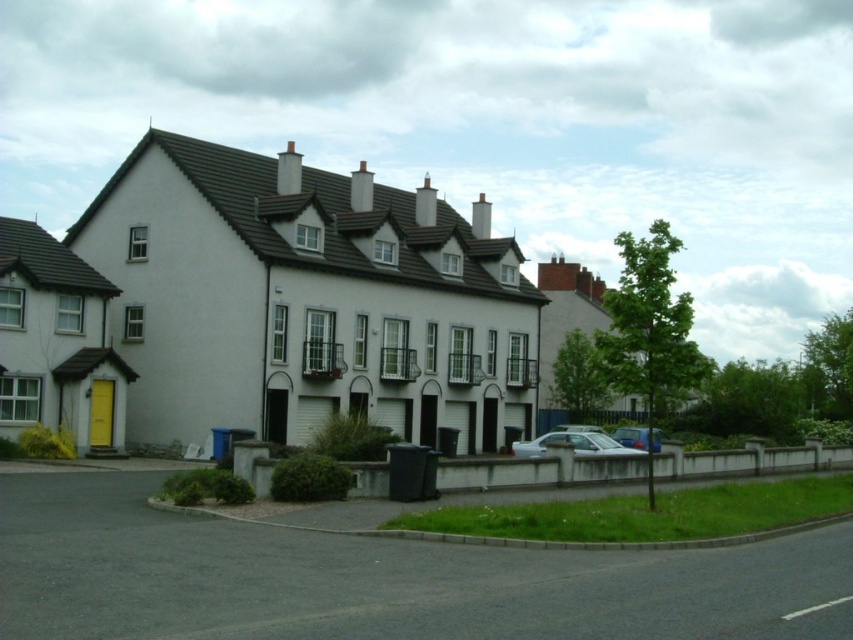
Who is taller, blue metallic car at lower right or metallic silver car at center?

Standing taller between the two is blue metallic car at lower right.

Image resolution: width=853 pixels, height=640 pixels. I want to click on blue metallic car at lower right, so click(631, 436).

Measure the distance between silver metallic car at center and metallic silver car at center.

A distance of 22.07 feet exists between silver metallic car at center and metallic silver car at center.

Can you confirm if silver metallic car at center is taller than metallic silver car at center?

Indeed, silver metallic car at center has a greater height compared to metallic silver car at center.

Who is more forward, (538, 452) or (570, 426)?

Point (538, 452) is more forward.

This screenshot has height=640, width=853. In order to click on silver metallic car at center in this screenshot , I will do (x=573, y=444).

Can you confirm if silver metallic car at center is positioned to the left of blue metallic car at lower right?

Yes, silver metallic car at center is to the left of blue metallic car at lower right.

Does silver metallic car at center appear over blue metallic car at lower right?

Correct, silver metallic car at center is located above blue metallic car at lower right.

Which is behind, point (637, 449) or point (657, 448)?

The point (637, 449) is more distant.

Locate an element on the screen. Image resolution: width=853 pixels, height=640 pixels. silver metallic car at center is located at coordinates pos(573,444).